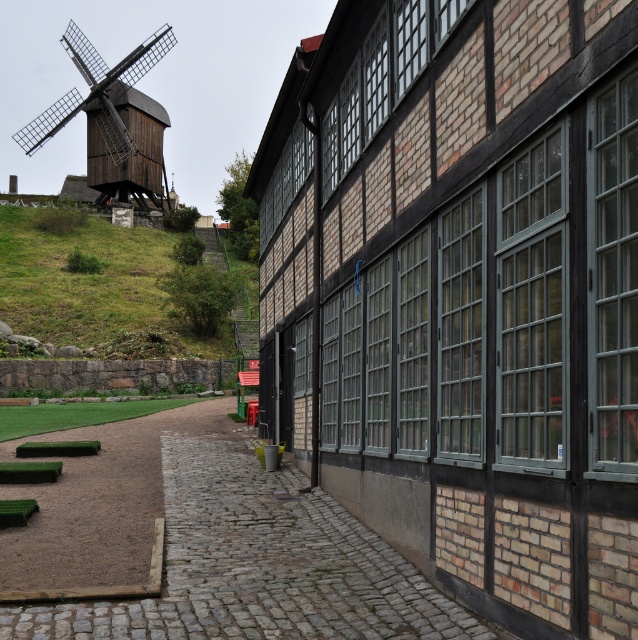
Question: Is cobblestone path at lower left further to the viewer compared to green grass at lower left?

Choices:
 (A) no
 (B) yes

Answer: (A)

Question: From the image, what is the correct spatial relationship of cobblestone path at lower left in relation to wooden windmill at left?

Choices:
 (A) left
 (B) right

Answer: (B)

Question: Estimate the real-world distances between objects in this image. Which object is closer to the cobblestone path at lower left?

Choices:
 (A) wooden windmill at left
 (B) green grass at lower left

Answer: (B)

Question: Among these points, which one is nearest to the camera?

Choices:
 (A) (152, 310)
 (B) (202, 497)

Answer: (B)

Question: Does green grass at lower left have a greater width compared to wooden windmill at left?

Choices:
 (A) no
 (B) yes

Answer: (A)

Question: Considering the real-world distances, which object is closest to the wooden windmill at left?

Choices:
 (A) cobblestone path at lower left
 (B) green grass at lower left

Answer: (B)